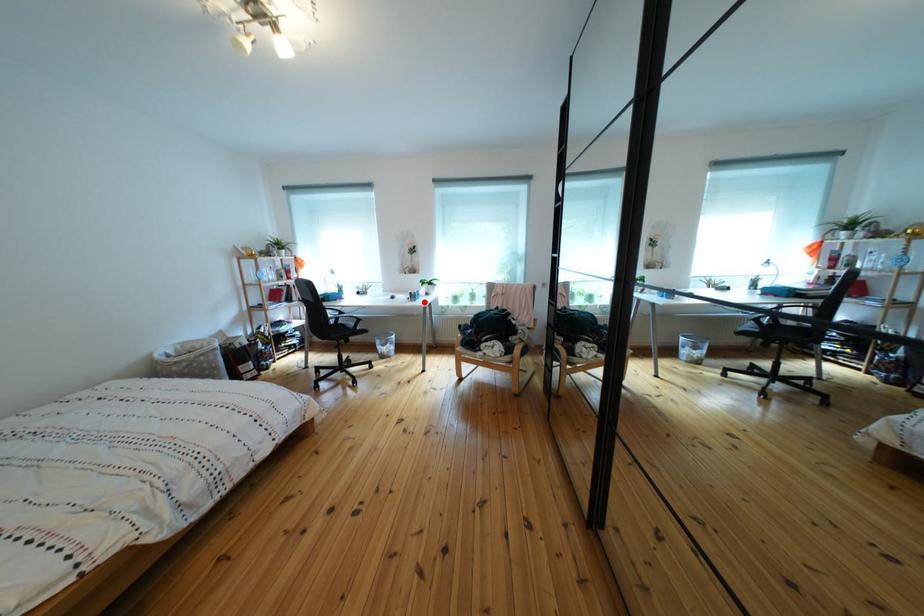
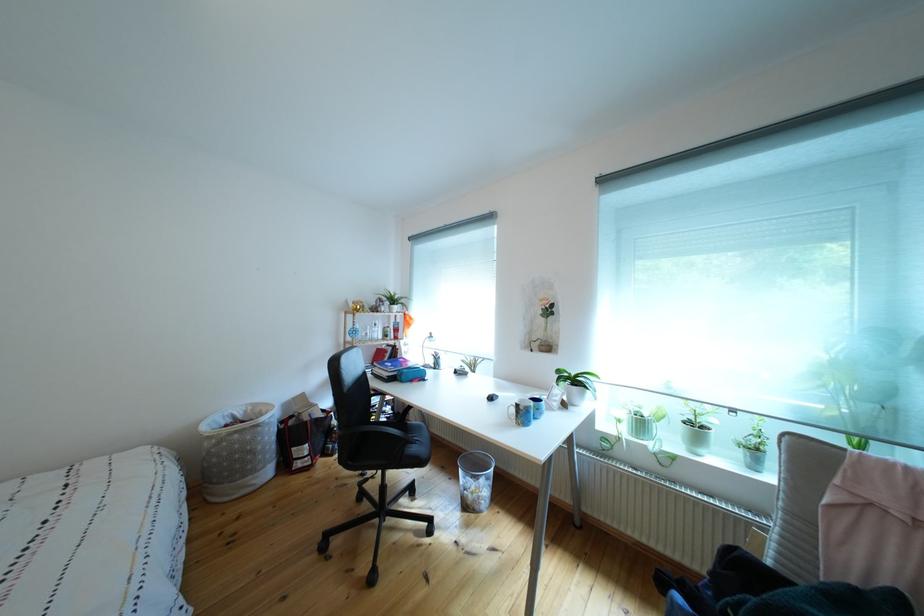
Where in the second image is the point corresponding to the highlighted location from the first image?

(533, 419)